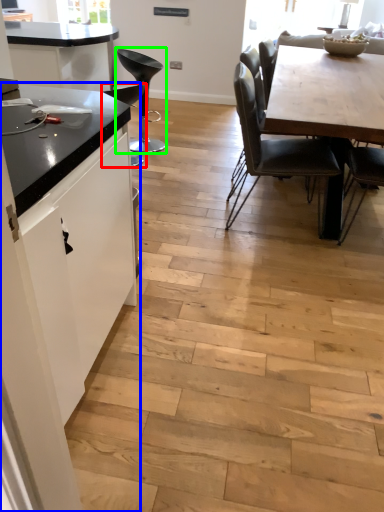
Question: Based on their relative distances, which object is nearer to chair (highlighted by a red box)? Choose from cabinetry (highlighted by a blue box) and chair (highlighted by a green box).

Choices:
 (A) cabinetry
 (B) chair

Answer: (B)